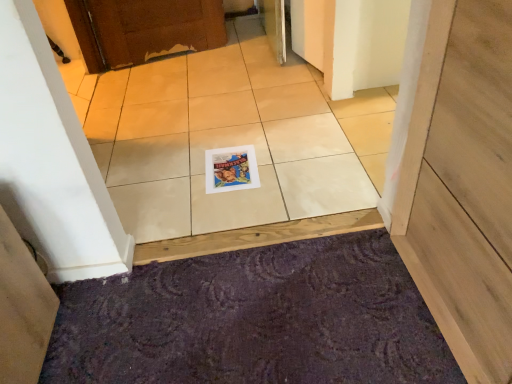
Question: Is matte paper magazine at center looking in the opposite direction of purple textured doormat at lower center?

Choices:
 (A) no
 (B) yes

Answer: (A)

Question: Does matte paper magazine at center have a larger size compared to purple textured doormat at lower center?

Choices:
 (A) yes
 (B) no

Answer: (B)

Question: Can you confirm if matte paper magazine at center is smaller than purple textured doormat at lower center?

Choices:
 (A) yes
 (B) no

Answer: (A)

Question: Can you confirm if matte paper magazine at center is positioned to the right of purple textured doormat at lower center?

Choices:
 (A) yes
 (B) no

Answer: (B)

Question: Is matte paper magazine at center touching purple textured doormat at lower center?

Choices:
 (A) no
 (B) yes

Answer: (A)

Question: Does matte paper magazine at center have a lesser width compared to purple textured doormat at lower center?

Choices:
 (A) yes
 (B) no

Answer: (A)

Question: From a real-world perspective, does purple textured doormat at lower center stand above matte paper magazine at center?

Choices:
 (A) no
 (B) yes

Answer: (A)

Question: Considering the relative sizes of purple textured doormat at lower center and matte paper magazine at center in the image provided, is purple textured doormat at lower center taller than matte paper magazine at center?

Choices:
 (A) no
 (B) yes

Answer: (B)

Question: Is purple textured doormat at lower center at the right side of matte paper magazine at center?

Choices:
 (A) yes
 (B) no

Answer: (A)

Question: Is purple textured doormat at lower center in front of matte paper magazine at center?

Choices:
 (A) no
 (B) yes

Answer: (B)

Question: From the image's perspective, does purple textured doormat at lower center appear higher than matte paper magazine at center?

Choices:
 (A) no
 (B) yes

Answer: (A)

Question: Is purple textured doormat at lower center positioned behind matte paper magazine at center?

Choices:
 (A) no
 (B) yes

Answer: (A)

Question: From a real-world perspective, is matte paper magazine at center below white glossy tile at center?

Choices:
 (A) yes
 (B) no

Answer: (A)